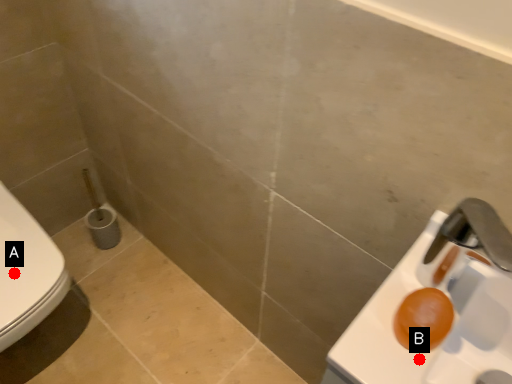
Question: Two points are circled on the image, labeled by A and B beside each circle. Which point is farther from the camera taking this photo?

Choices:
 (A) A is further
 (B) B is further

Answer: (A)